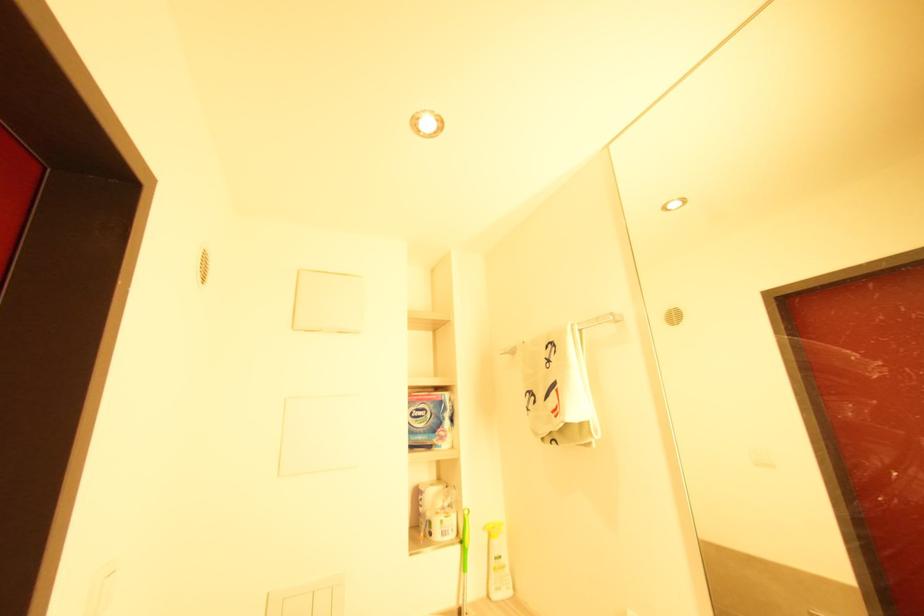
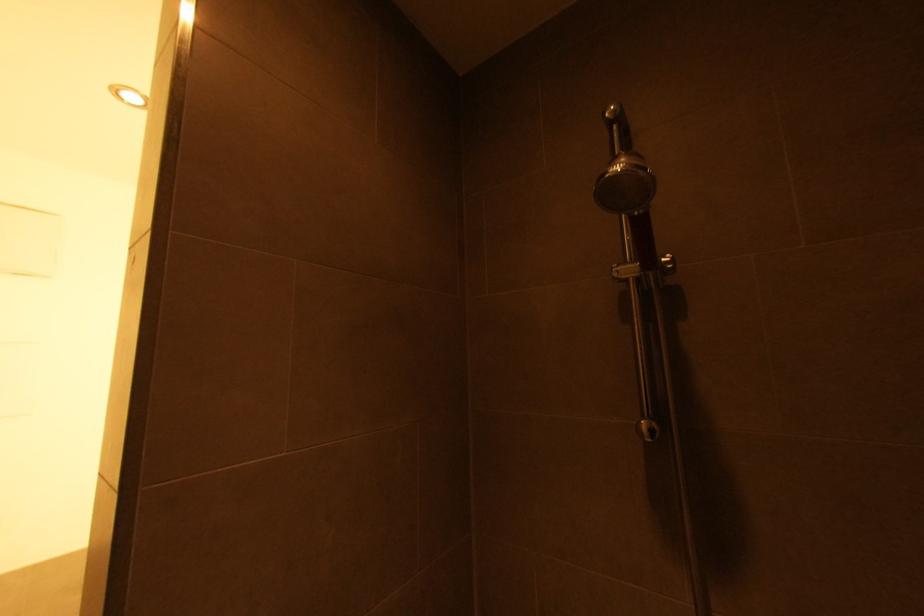
Question: Based on the continuous images, in which direction is the camera rotating? Reply with the corresponding letter.

Choices:
 (A) Left
 (B) Right
 (C) Up
 (D) Down

Answer: (B)